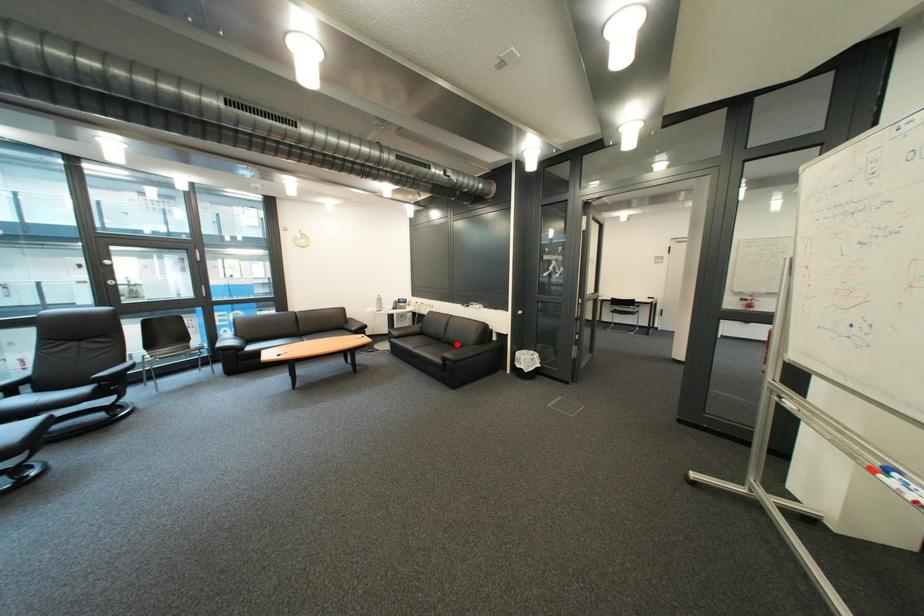
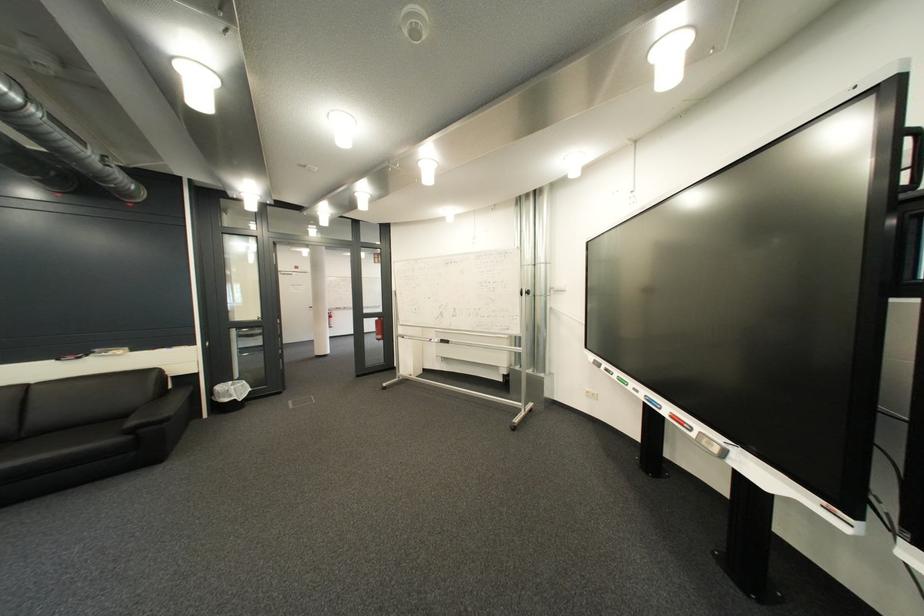
Question: I am providing you with two images of the same scene from different viewpoints. A red point is marked on the first image. Is the red point's position out of view in image 2?

Choices:
 (A) Yes
 (B) No

Answer: (B)